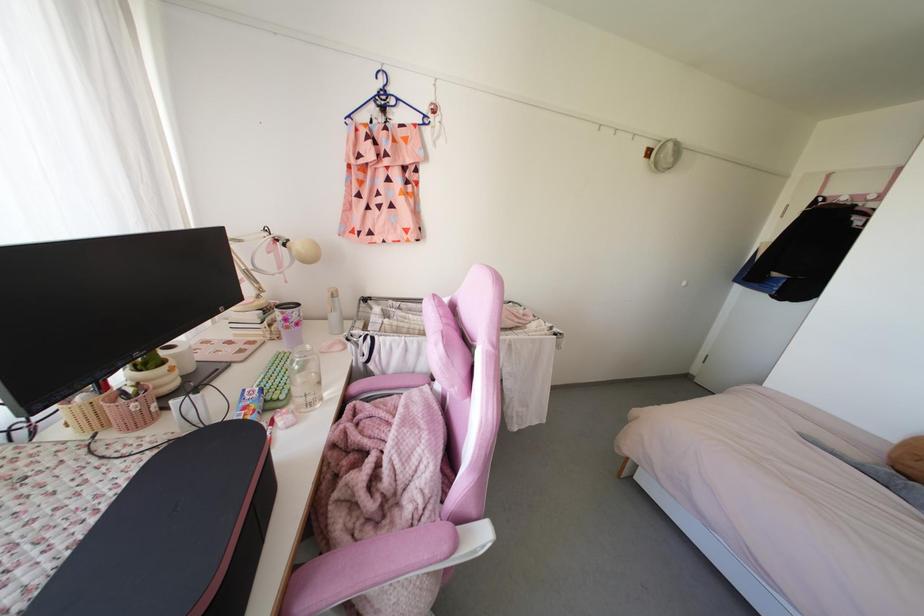
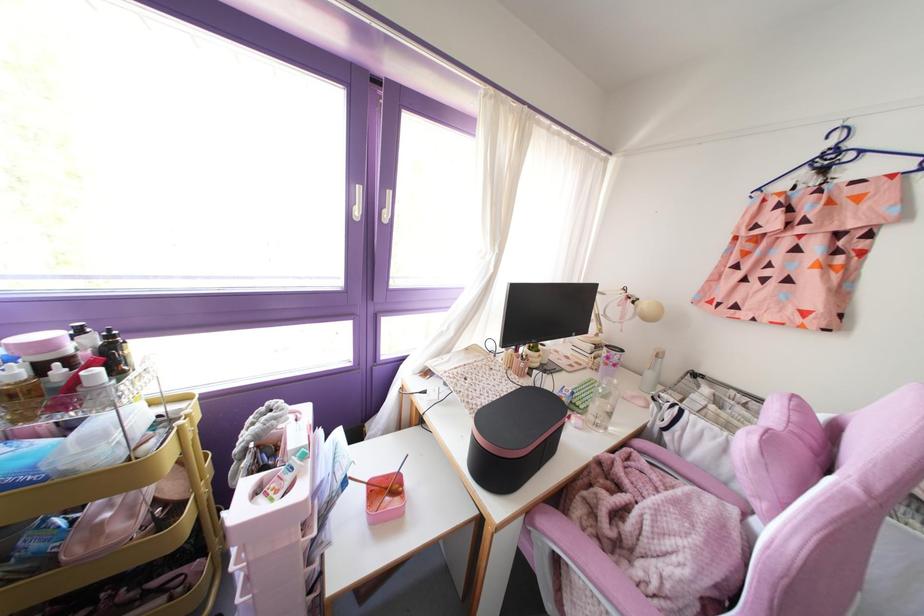
Find the pixel in the second image that matches pixel 333 315 in the first image.

(649, 374)